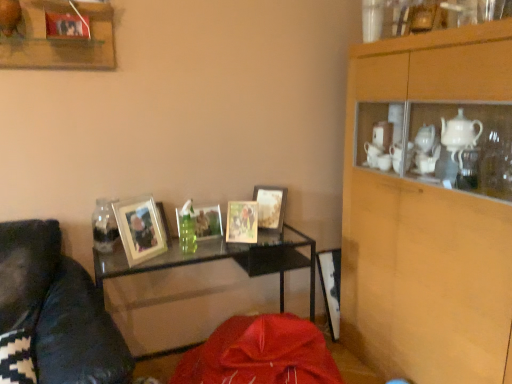
Question: Is point (134, 240) positioned closer to the camera than point (402, 233)?

Choices:
 (A) closer
 (B) farther

Answer: (A)

Question: From the image's perspective, relative to wooden cabinet at upper right, is matte silver picture frame at center-left, acting as the fourth picture frame starting from the right, above or below?

Choices:
 (A) below
 (B) above

Answer: (A)

Question: Which object is the farthest from the clear glass jar at left?

Choices:
 (A) wooden photo frame at center, placed as the first picture frame when sorted from right to left
 (B) matte wooden picture frame at center, which ranks as the 2th picture frame in right-to-left order
 (C) matte silver picture frame at center-left, placed as the 1th picture frame when sorted from left to right
 (D) wooden cabinet at upper right
 (E) metallic silver picture frame at center, acting as the 2th picture frame starting from the left

Answer: (D)

Question: Which object is positioned closest to the wooden photo frame at center, positioned as the 4th picture frame in left-to-right order?

Choices:
 (A) matte wooden picture frame at center, which ranks as the 2th picture frame in right-to-left order
 (B) wooden cabinet at upper right
 (C) wooden frame at upper left
 (D) metallic silver picture frame at center, acting as the 2th picture frame starting from the left
 (E) matte silver picture frame at center-left, acting as the fourth picture frame starting from the right

Answer: (A)